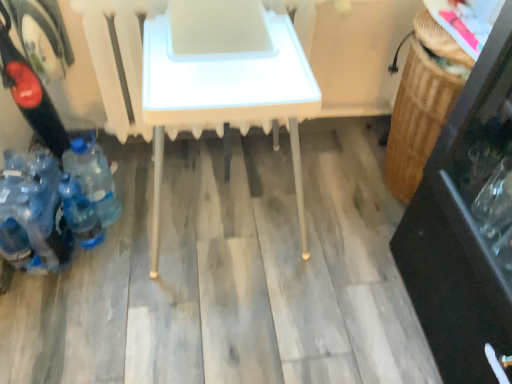
You are a GUI agent. You are given a task and a screenshot of the screen. Output one action in this format:
    pyautogui.click(x=<x>, y=<y>)
    Task: Click on the blank space situated above blue plastic bottles at lower left, the first bottle in the left-to-right sequence (from a real-world perspective)
    Image resolution: width=512 pixels, height=384 pixels.
    Given the screenshot: What is the action you would take?
    click(x=13, y=181)